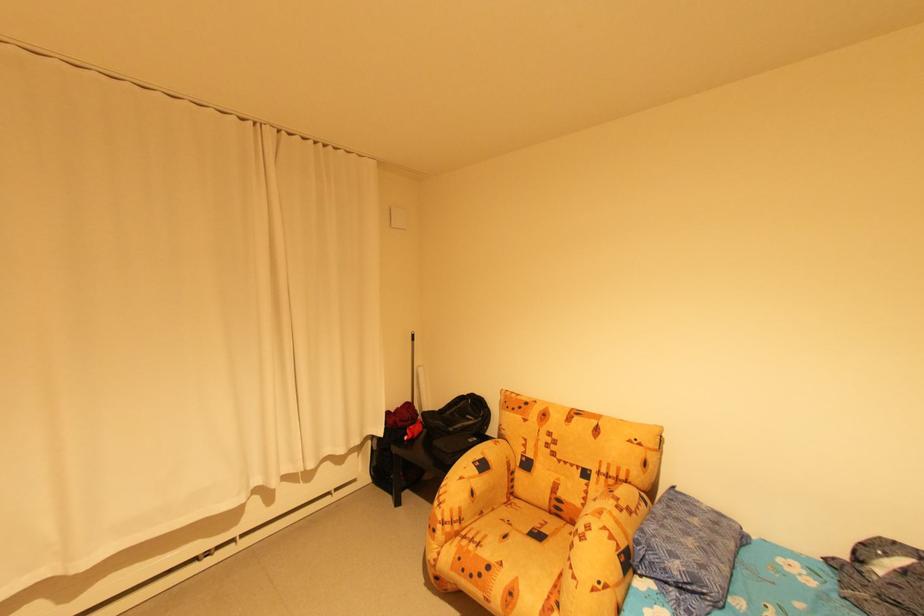
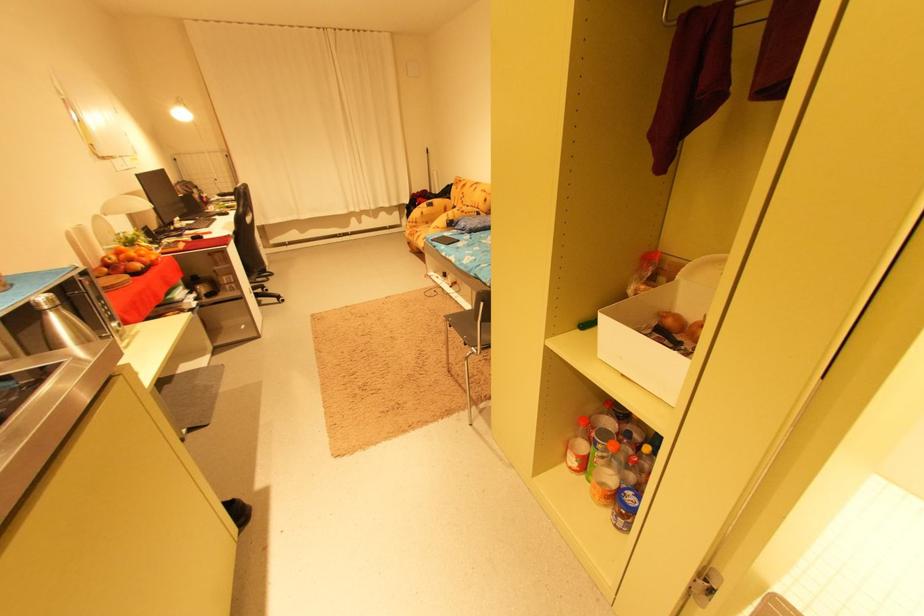
Where in the second image is the point corresponding to pixel 532 421 from the first image?

(464, 188)